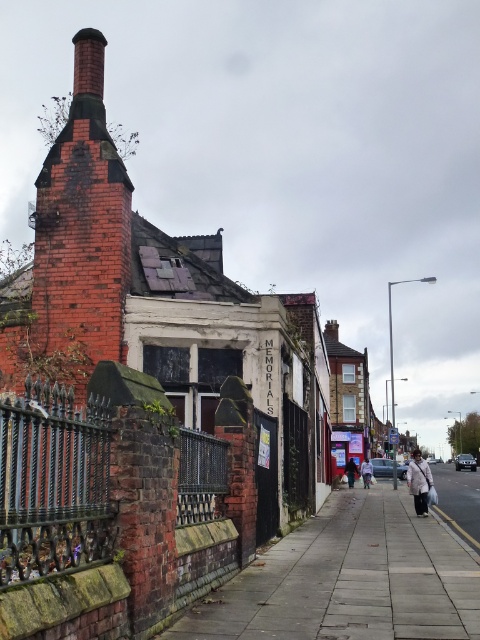
Question: Does smooth concrete pavement at center have a greater width compared to dark brown leather jacket at center?

Choices:
 (A) no
 (B) yes

Answer: (B)

Question: Which point is farther from the camera taking this photo?

Choices:
 (A) (425, 467)
 (B) (311, 588)

Answer: (A)

Question: Among these points, which one is nearest to the camera?

Choices:
 (A) (412, 481)
 (B) (367, 467)
 (C) (352, 476)

Answer: (A)

Question: Is smooth concrete pavement at center wider than dark brown leather jacket at center?

Choices:
 (A) no
 (B) yes

Answer: (B)

Question: Which of the following is the farthest from the observer?

Choices:
 (A) (422, 470)
 (B) (452, 541)

Answer: (A)

Question: Is light beige coat at center in front of light beige fabric coat at center?

Choices:
 (A) yes
 (B) no

Answer: (A)